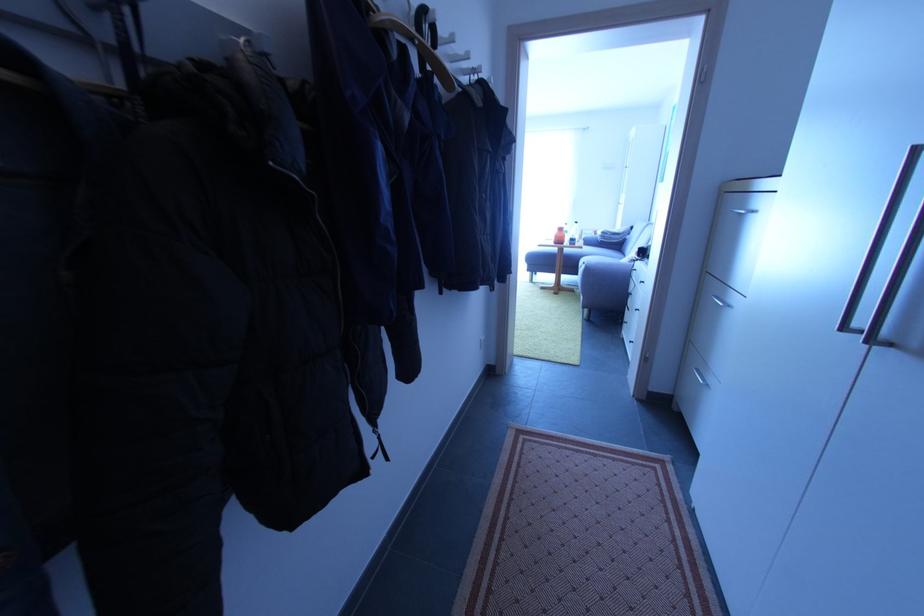
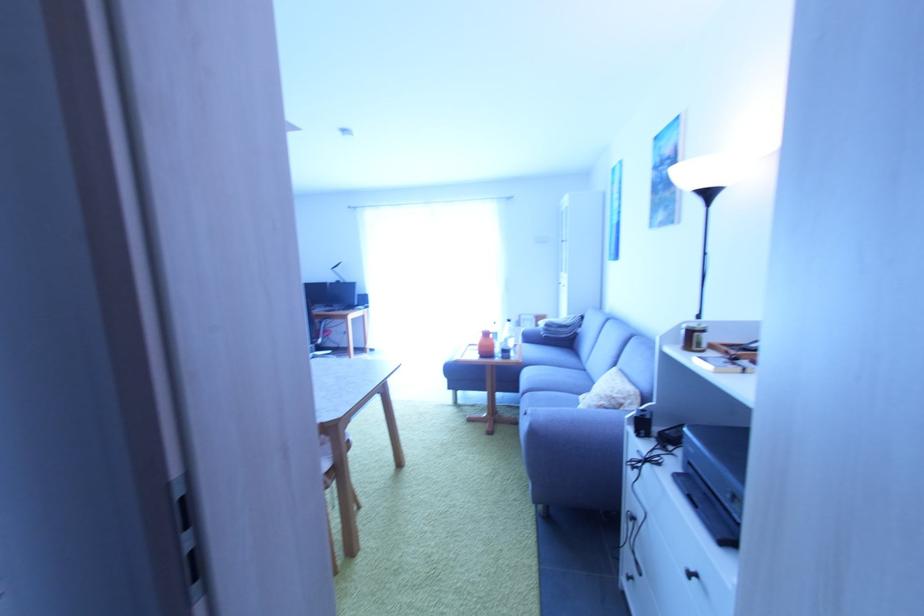
The point at (591, 272) is marked in the first image. Where is the corresponding point in the second image?

(538, 435)